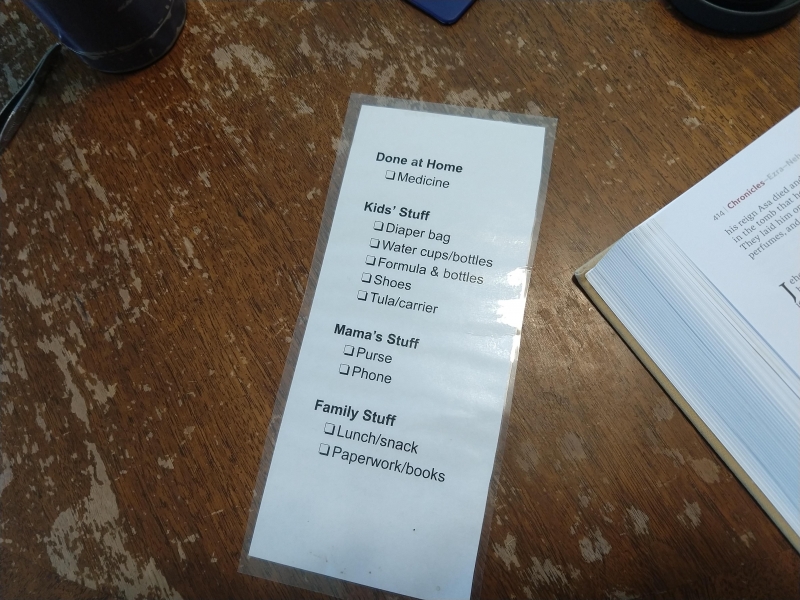
Locate an element on the screen. This screenshot has height=600, width=800. kids stuff is located at coordinates (406, 210).